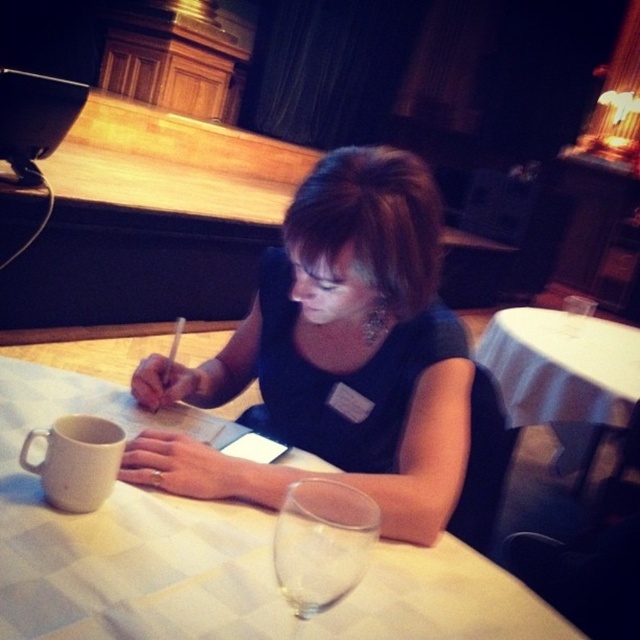
Question: Which object appears farthest from the camera in this image?

Choices:
 (A) matte black dress at center
 (B) transparent glass at table

Answer: (A)

Question: Estimate the real-world distances between objects in this image. Which object is closer to the white checkered tablecloth at center?

Choices:
 (A) matte black dress at center
 (B) white cloth-covered table at center
 (C) transparent glass at table

Answer: (A)

Question: Can you confirm if matte black dress at center is positioned to the left of white cloth-covered table at center?

Choices:
 (A) yes
 (B) no

Answer: (A)

Question: Considering the relative positions of white checkered tablecloth at center and white cloth-covered table at center in the image provided, where is white checkered tablecloth at center located with respect to white cloth-covered table at center?

Choices:
 (A) below
 (B) above

Answer: (A)

Question: Considering the relative positions of white checkered tablecloth at center and white matte mug at lower left in the image provided, where is white checkered tablecloth at center located with respect to white matte mug at lower left?

Choices:
 (A) above
 (B) below

Answer: (B)

Question: Which of the following is the farthest from the observer?

Choices:
 (A) white checkered tablecloth at center
 (B) white cloth-covered table at center

Answer: (B)